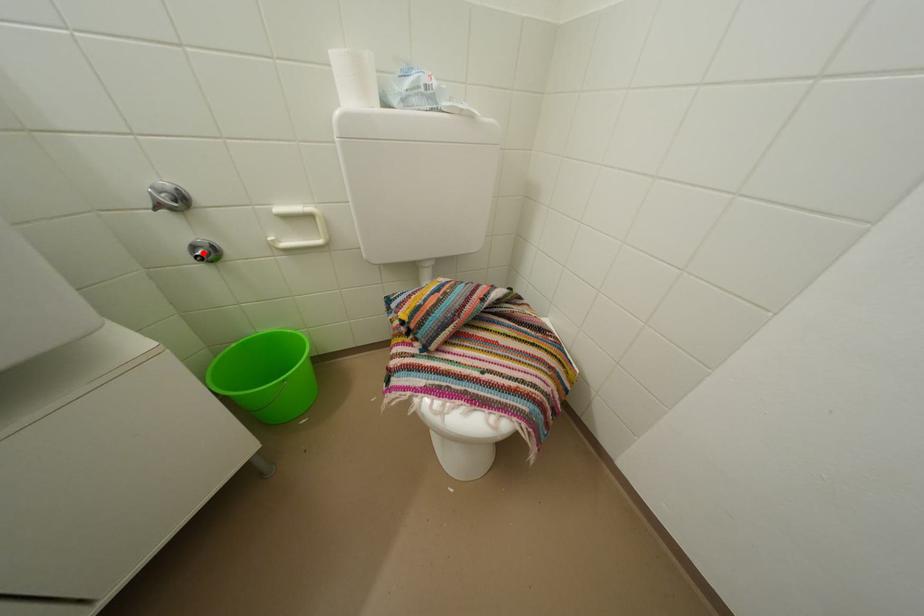
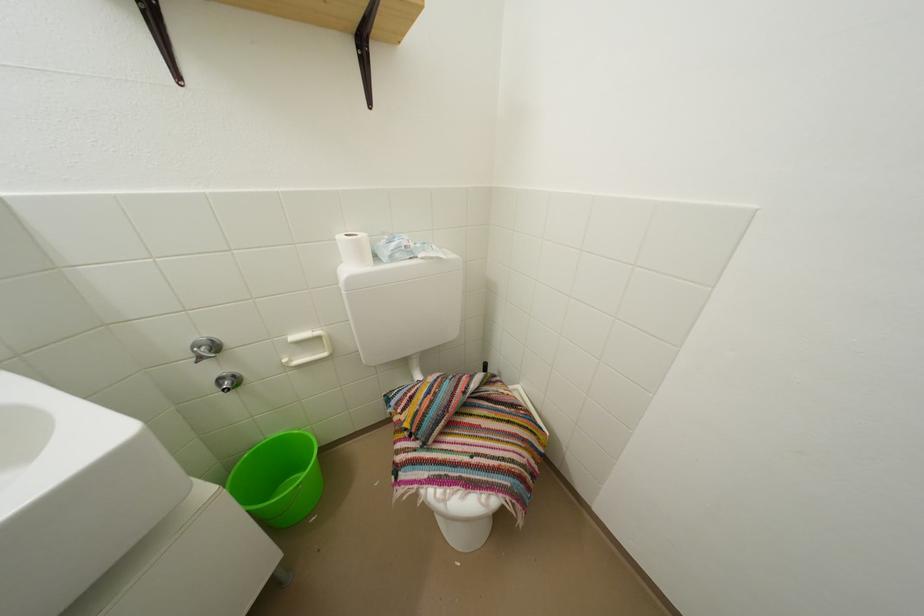
Where in the second image is the point corresponding to the highlighted location from the first image?

(229, 386)